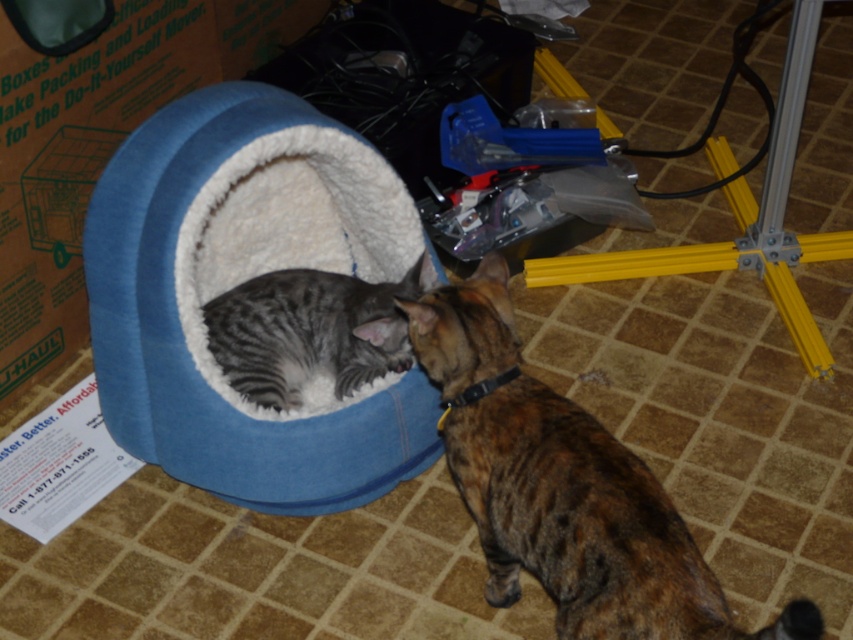
You are a cat owner who wants to place a 15 inch wide toy between the brown textured fur cat at center and the gray striped cat at center. Will the toy fit between them?

The distance between the brown textured fur cat at center and the gray striped cat at center is 14.97 inches. Since the toy is 15 inches wide, it will not fit between them as the space is slightly smaller than the toy.

You are a cat owner trying to place a new toy between the two cats. The first cat is at point (523, 452) and the second cat is at point (260, 328). Which cat is closer to you so you can decide where to place the toy?

The cat at point (523, 452) is closer to you than the cat at point (260, 328), so you should place the toy near the closer cat to avoid startling them both.

Consider the image. You are a cat owner who wants to ensure both cats have enough space to rest comfortably. Given the sizes of the blue plush cat bed at center and the brown textured fur cat at center, can the cat fit inside the bed?

The blue plush cat bed at center is bigger than the brown textured fur cat at center, so the cat can fit inside the bed comfortably.